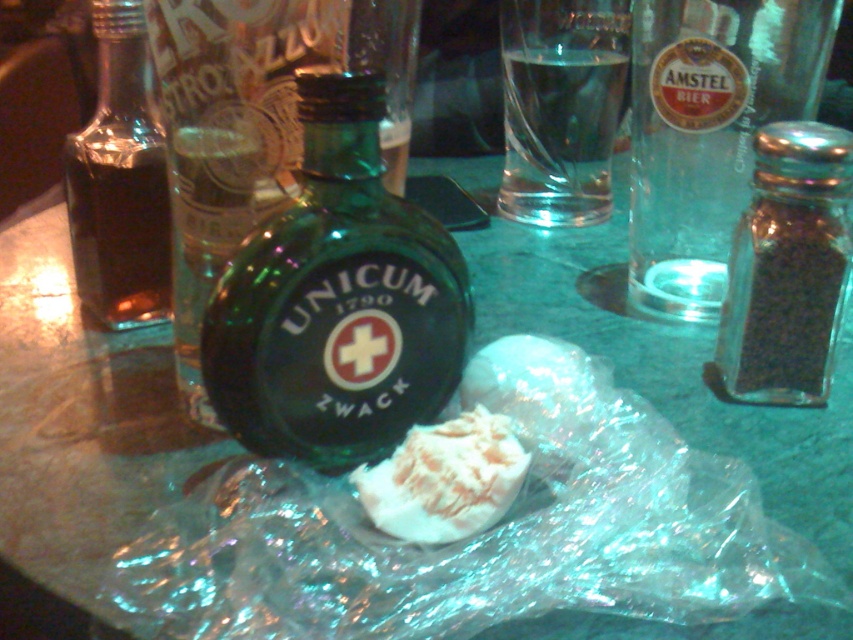
You are setting up a display for a liqueur tasting event. You have a green glass bottle at center and a dark brown glass bottle at left. Which bottle should you place in a larger designated spot to accommodate its size?

The dark brown glass bottle at left requires the larger designated spot because it occupies more space than the green glass bottle at center.

You are a photographer trying to capture a close shot of the green UNICUM bottle. You are currently focused on the point at coordinates point (265, 276). If your camera has a depth of field that can clearly capture objects within 10 inches from the focus point, will the UNICUM bottle be in focus?

The distance of point (265, 276) from the camera is 10.18 inches. Since the depth of field can capture objects within 10 inches, the UNICUM bottle is slightly beyond the 10 inch threshold, so it may not be in focus.